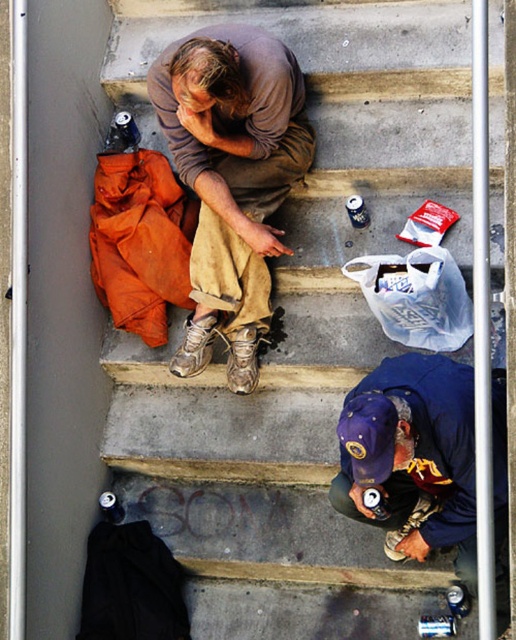
You are a fashion designer observing two people on stairs. You need to determine which clothing item has a smaller width for your next collection. Which one is narrower between the brown cotton shirt at center and the blue fabric cap at lower center?

The brown cotton shirt at center has a smaller width compared to the blue fabric cap at lower center, so it is narrower.

You are a delivery person who needs to place a small package between the brown leather shoe at center and the brown leather boot at center. Which object should you place the package closer to to ensure it fits within the space between them?

The brown leather shoe at center is wider than the brown leather boot at center. To ensure the package fits, place it closer to the brown leather shoe at center since its width provides more space.